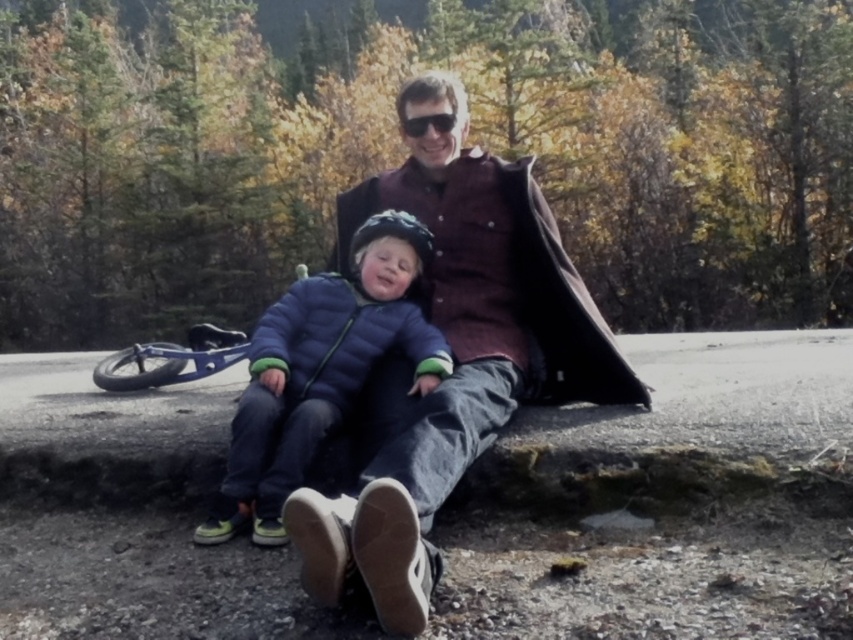
The width and height of the screenshot is (853, 640). I want to click on maroon button-up shirt at center, so click(x=453, y=358).

Is point (318, 536) farther from viewer compared to point (439, 115)?

That is False.

You are a GUI agent. You are given a task and a screenshot of the screen. Output one action in this format:
    pyautogui.click(x=<x>, y=<y>)
    Task: Click on the maroon button-up shirt at center
    Image resolution: width=853 pixels, height=640 pixels.
    Given the screenshot: What is the action you would take?
    pyautogui.click(x=453, y=358)

Can you confirm if maroon button-up shirt at center is shorter than blue puffy jacket at center?

No.

Does point (496, 260) come closer to viewer compared to point (334, 412)?

No, (496, 260) is behind (334, 412).

Does point (474, 204) come farther from viewer compared to point (338, 276)?

Yes.

Where is `maroon button-up shirt at center`? maroon button-up shirt at center is located at coordinates (453, 358).

Does point (309, 330) come closer to viewer compared to point (433, 115)?

Yes, point (309, 330) is in front of point (433, 115).

Who is more forward, (305, 368) or (407, 131)?

Point (305, 368) is in front.

The height and width of the screenshot is (640, 853). Describe the element at coordinates (321, 371) in the screenshot. I see `blue puffy jacket at center` at that location.

What are the coordinates of `blue puffy jacket at center` in the screenshot? It's located at [321, 371].